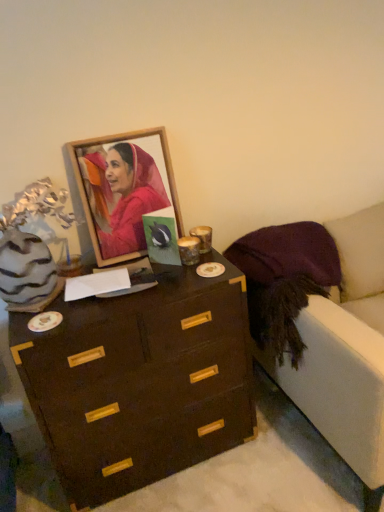
Question: Considering the relative sizes of wooden frame at upper center and dark wood chest of drawers at center in the image provided, is wooden frame at upper center taller than dark wood chest of drawers at center?

Choices:
 (A) no
 (B) yes

Answer: (A)

Question: Is wooden frame at upper center further to camera compared to dark wood chest of drawers at center?

Choices:
 (A) yes
 (B) no

Answer: (A)

Question: Would you say wooden frame at upper center contains dark wood chest of drawers at center?

Choices:
 (A) no
 (B) yes

Answer: (A)

Question: From the image's perspective, is wooden frame at upper center located beneath dark wood chest of drawers at center?

Choices:
 (A) yes
 (B) no

Answer: (B)

Question: Is wooden frame at upper center turned away from dark wood chest of drawers at center?

Choices:
 (A) yes
 (B) no

Answer: (B)

Question: Based on their sizes in the image, would you say dark wood chest of drawers at center is bigger or smaller than velvet purple armchair at right?

Choices:
 (A) big
 (B) small

Answer: (B)

Question: Does point coord(208,279) appear closer or farther from the camera than point coord(344,393)?

Choices:
 (A) closer
 (B) farther

Answer: (B)

Question: Looking at their shapes, would you say dark wood chest of drawers at center is wider or thinner than velvet purple armchair at right?

Choices:
 (A) wide
 (B) thin

Answer: (B)

Question: From their relative heights in the image, would you say dark wood chest of drawers at center is taller or shorter than velvet purple armchair at right?

Choices:
 (A) tall
 (B) short

Answer: (B)

Question: Looking at the image, does wooden frame at upper center seem bigger or smaller compared to velvet purple armchair at right?

Choices:
 (A) big
 (B) small

Answer: (B)

Question: From a real-world perspective, is wooden frame at upper center positioned above or below velvet purple armchair at right?

Choices:
 (A) below
 (B) above

Answer: (B)

Question: Is wooden frame at upper center to the left or to the right of velvet purple armchair at right in the image?

Choices:
 (A) right
 (B) left

Answer: (B)

Question: Does point (140, 172) appear closer or farther from the camera than point (317, 399)?

Choices:
 (A) closer
 (B) farther

Answer: (B)

Question: Choose the correct answer: Is dark wood chest of drawers at center inside wooden frame at upper center or outside it?

Choices:
 (A) outside
 (B) inside

Answer: (A)

Question: Would you say dark wood chest of drawers at center is to the left or to the right of wooden frame at upper center in the picture?

Choices:
 (A) right
 (B) left

Answer: (A)